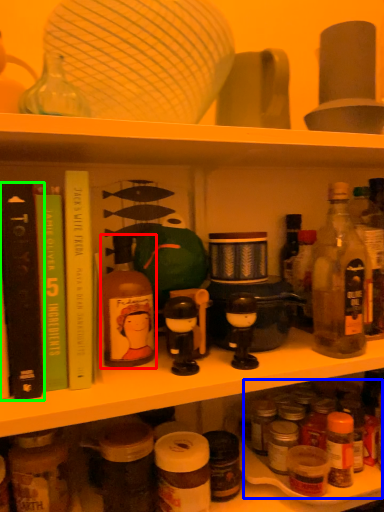
Question: Considering the real-world distances, which object is closest to bottle (highlighted by a red box)? drink (highlighted by a blue box) or book (highlighted by a green box).

Choices:
 (A) drink
 (B) book

Answer: (B)